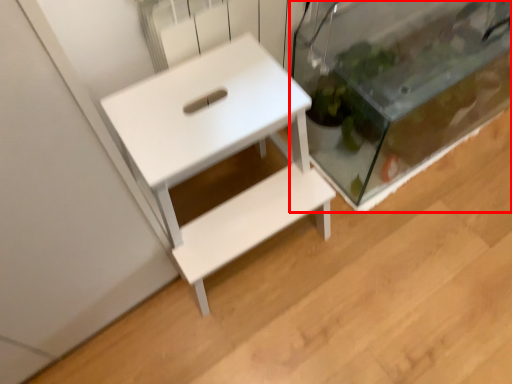
Question: From the image's perspective, where is glass box (annotated by the red box) located in relation to table in the image?

Choices:
 (A) below
 (B) above

Answer: (B)